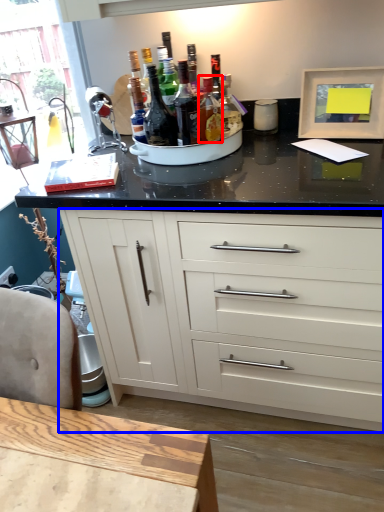
Question: Which of the following is the farthest to the observer, bottle (highlighted by a red box) or cabinetry (highlighted by a blue box)?

Choices:
 (A) bottle
 (B) cabinetry

Answer: (A)